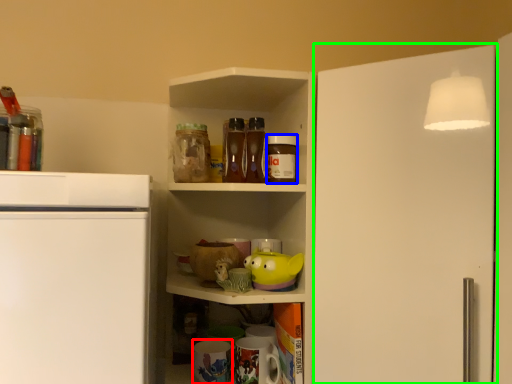
Question: Estimate the real-world distances between objects in this image. Which object is closer to appliance (highlighted by a red box), beverage (highlighted by a blue box) or door (highlighted by a green box)?

Choices:
 (A) beverage
 (B) door

Answer: (A)